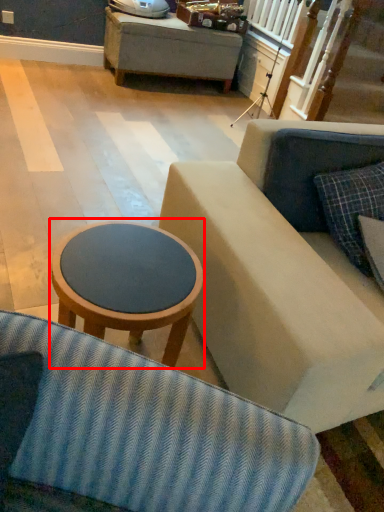
Question: In this image, where is table (annotated by the red box) located relative to pillow?

Choices:
 (A) right
 (B) left

Answer: (B)